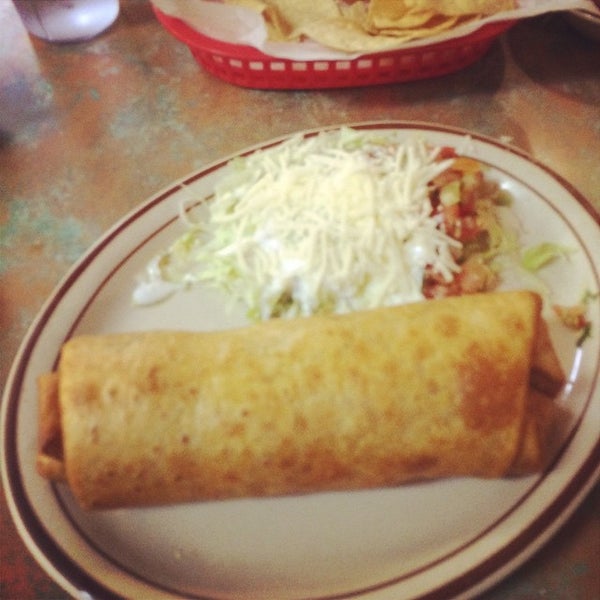
You are a GUI agent. You are given a task and a screenshot of the screen. Output one action in this format:
    pyautogui.click(x=<x>, y=<y>)
    Task: Click on the red plastic chip basket
    
    Given the screenshot: What is the action you would take?
    pyautogui.click(x=398, y=72)